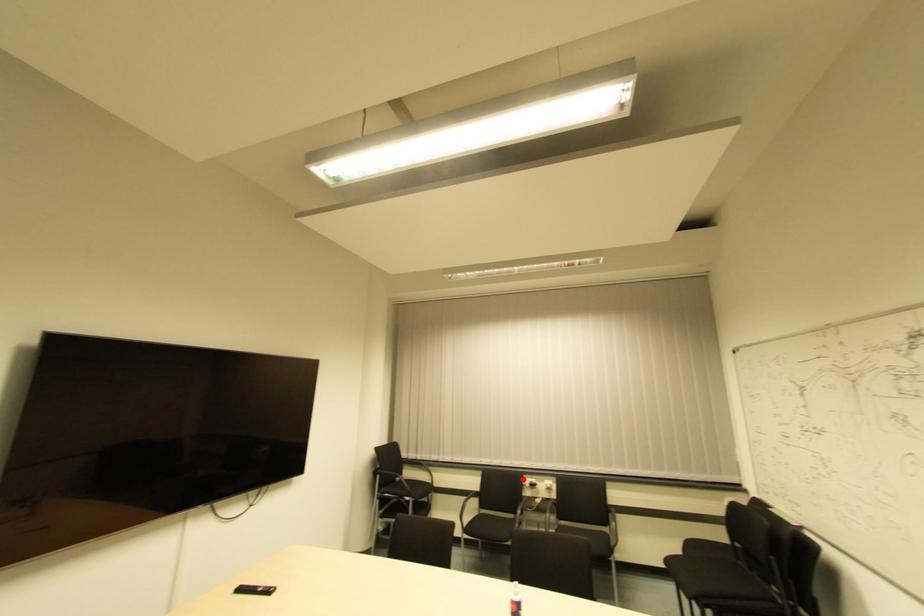
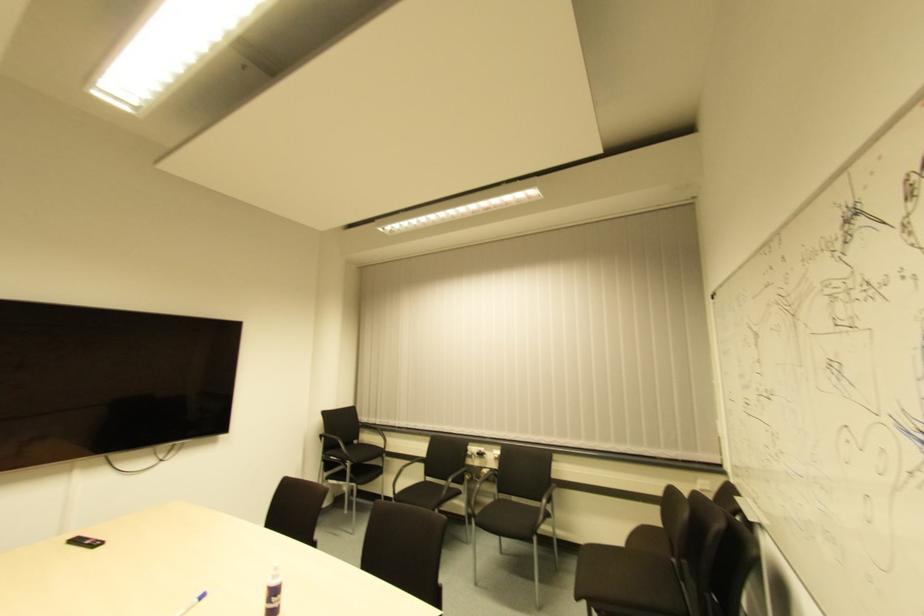
Question: I am providing you with two images of the same scene from different viewpoints. A red point is marked on the first image. Can you still see the location of the red point in image 2?

Choices:
 (A) Yes
 (B) No

Answer: (A)